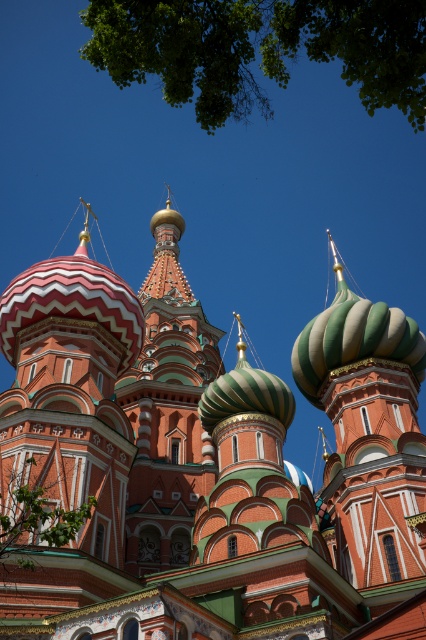
Based on the photo, who is taller, green leafy tree at upper center or green glossy onion dome at upper right?

Standing taller between the two is green leafy tree at upper center.

Does green leafy tree at upper center appear on the left side of green glossy onion dome at upper right?

Indeed, green leafy tree at upper center is positioned on the left side of green glossy onion dome at upper right.

At what (x,y) coordinates should I click in order to perform the action: click on green leafy tree at upper center. Please return your answer as a coordinate pair (x, y). Looking at the image, I should click on (259, 49).

Is point (127, 435) in front of point (155, 232)?

Yes, point (127, 435) is in front of point (155, 232).

Can you confirm if red and white striped dome at center is shorter than polished red brick tower at center?

Yes.

This screenshot has width=426, height=640. What are the coordinates of `red and white striped dome at center` in the screenshot? It's located at (66, 406).

At what (x,y) coordinates should I click in order to perform the action: click on red and white striped dome at center. Please return your answer as a coordinate pair (x, y). The height and width of the screenshot is (640, 426). Looking at the image, I should click on (66, 406).

Is green glossy dome at center positioned at the back of green leafy tree at lower left?

Yes, green glossy dome at center is further from the viewer.

Does green glossy dome at center appear over green leafy tree at lower left?

Correct, green glossy dome at center is located above green leafy tree at lower left.

Does point (310, 372) come behind point (14, 550)?

Yes, point (310, 372) is behind point (14, 550).

The image size is (426, 640). In order to click on green glossy dome at center in this screenshot , I will do (x=353, y=337).